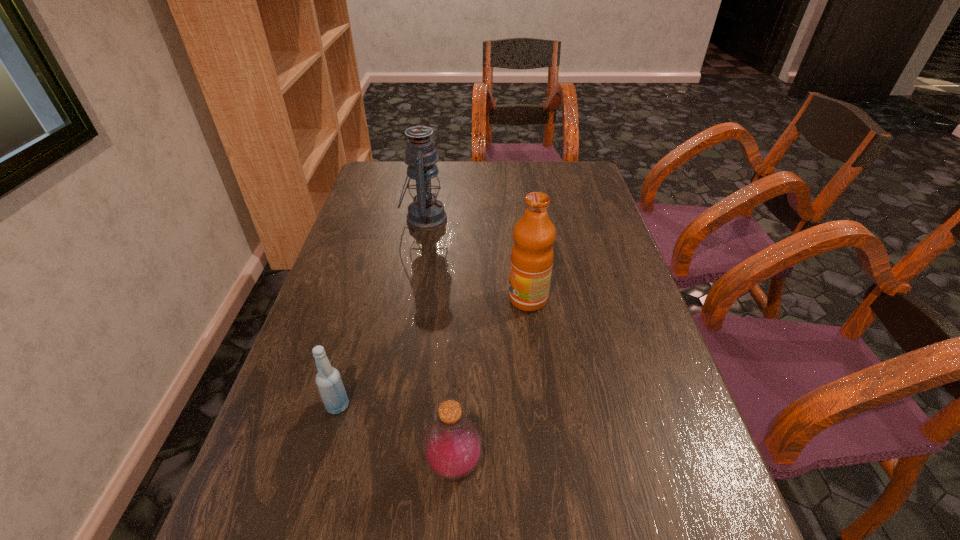
Where is `free space between the farthest object and the nearer bottle`? free space between the farthest object and the nearer bottle is located at coordinates (440, 342).

Identify the location of vacant region between the fruit juice and the leftmost object. This screenshot has width=960, height=540. (433, 353).

The image size is (960, 540). Find the location of `vacant space in between the fruit juice and the nearest object`. vacant space in between the fruit juice and the nearest object is located at coordinates (492, 382).

The width and height of the screenshot is (960, 540). Identify the location of unoccupied area between the nearer bottle and the left bottle. (396, 435).

Locate an element on the screen. The image size is (960, 540). vacant area that lies between the second farthest object and the lantern is located at coordinates (476, 259).

The height and width of the screenshot is (540, 960). What are the coordinates of `free space between the lantern and the second object from right to left` in the screenshot? It's located at (440, 342).

The width and height of the screenshot is (960, 540). Find the location of `unoccupied position between the lantern and the third nearest object`. unoccupied position between the lantern and the third nearest object is located at coordinates (476, 259).

The width and height of the screenshot is (960, 540). Identify the location of vacant region between the farthest object and the second farthest object. (476, 259).

In order to click on free space between the rightmost object and the farthest object in this screenshot , I will do `click(476, 259)`.

The image size is (960, 540). What are the coordinates of `object that is the second closest one to the third object from right to left` in the screenshot? It's located at (328, 379).